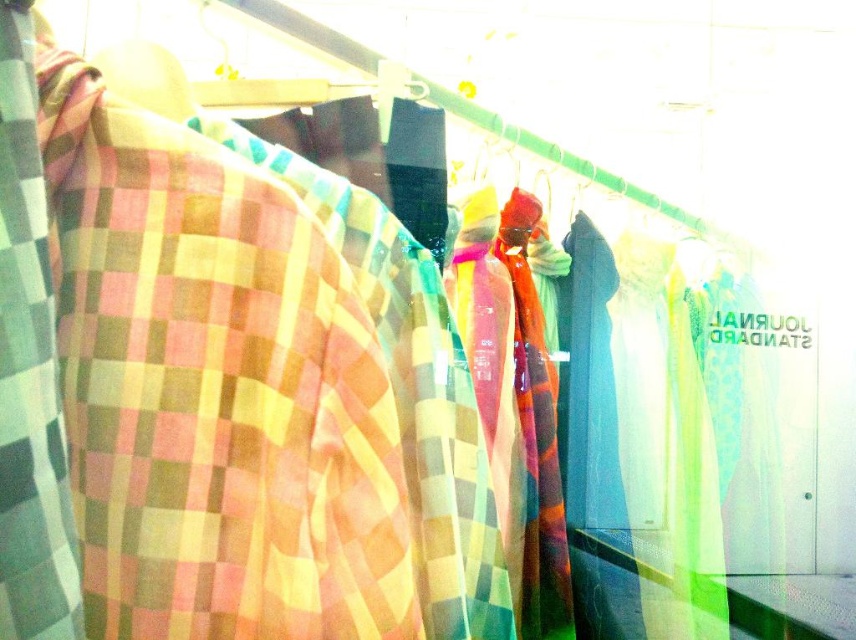
You are a customer in a store and want to pick up an item from the clothing rack. You notice two points on the rack marked as point (473, 570) and point (40, 413). Which point is closer to you?

Point (40, 413) is closer to you because point (473, 570) is behind it.

You are a customer trying to decide whether to buy the checkered fabric at left and the translucent multicolored scarf at center. From your current position, which item is closer to you?

The checkered fabric at left is closer to you because it is in front of the translucent multicolored scarf at center.